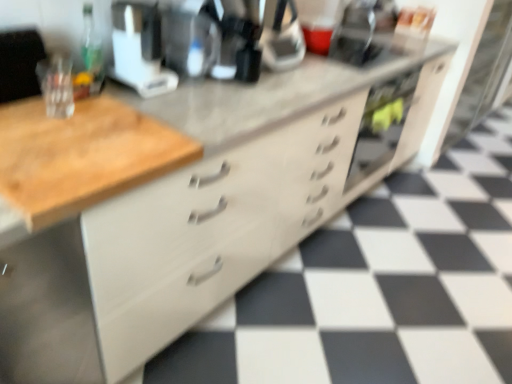
This screenshot has height=384, width=512. Identify the location of free location in front of green glass bottle at upper left. (104, 104).